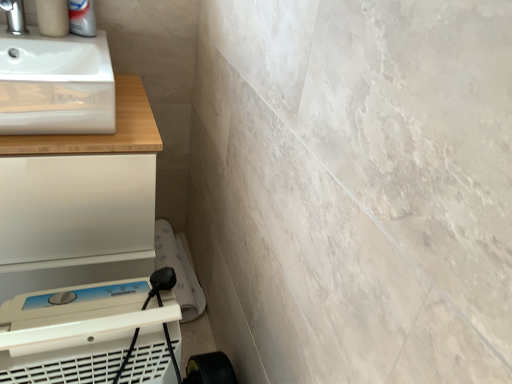
Question: From a real-world perspective, is white matte counter at upper left positioned above or below satin nickel faucet at upper left?

Choices:
 (A) above
 (B) below

Answer: (B)

Question: Is white matte counter at upper left in front of or behind satin nickel faucet at upper left in the image?

Choices:
 (A) front
 (B) behind

Answer: (A)

Question: Which object is positioned farthest from the white plastic air purifier at lower left?

Choices:
 (A) white glossy sink at upper left
 (B) white matte counter at upper left
 (C) satin nickel faucet at upper left

Answer: (C)

Question: Estimate the real-world distances between objects in this image. Which object is farther from the white matte counter at upper left?

Choices:
 (A) white glossy sink at upper left
 (B) satin nickel faucet at upper left
 (C) white plastic air purifier at lower left

Answer: (B)